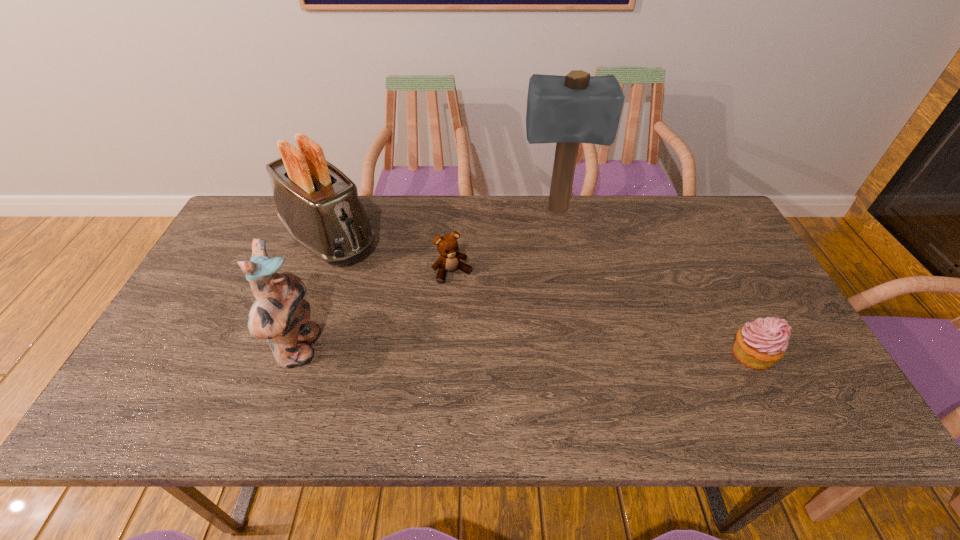
The image size is (960, 540). I want to click on free space between the toaster and the third object from left to right, so click(x=391, y=255).

The image size is (960, 540). Find the location of `vacant area that lies between the second object from right to left and the figurine`. vacant area that lies between the second object from right to left and the figurine is located at coordinates (428, 280).

Where is `vacant space in between the tallest object and the figurine`? This screenshot has width=960, height=540. vacant space in between the tallest object and the figurine is located at coordinates (428, 280).

You are a GUI agent. You are given a task and a screenshot of the screen. Output one action in this format:
    pyautogui.click(x=<x>, y=<y>)
    Task: Click on the vacant area that lies between the third object from right to left and the rightmost object
    The height and width of the screenshot is (540, 960).
    Given the screenshot: What is the action you would take?
    pyautogui.click(x=602, y=314)

Where is `free area in between the figurine and the toaster`? The height and width of the screenshot is (540, 960). free area in between the figurine and the toaster is located at coordinates [314, 294].

In order to click on vacant space that is in between the toaster and the teddy bear in this screenshot , I will do `click(391, 255)`.

Where is `vacant space that is in between the mallet and the teddy bear`? The width and height of the screenshot is (960, 540). vacant space that is in between the mallet and the teddy bear is located at coordinates (505, 242).

Find the location of a particular element. The height and width of the screenshot is (540, 960). empty space between the rightmost object and the toaster is located at coordinates (540, 296).

I want to click on vacant region between the cupcake and the mallet, so click(x=654, y=283).

Identify the location of vacant area between the figurine and the teddy bear. (376, 310).